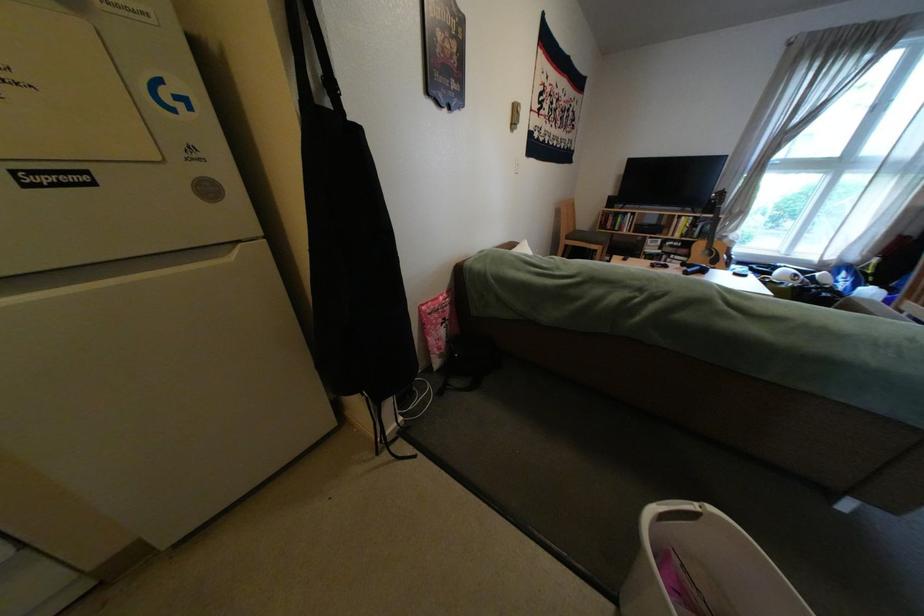
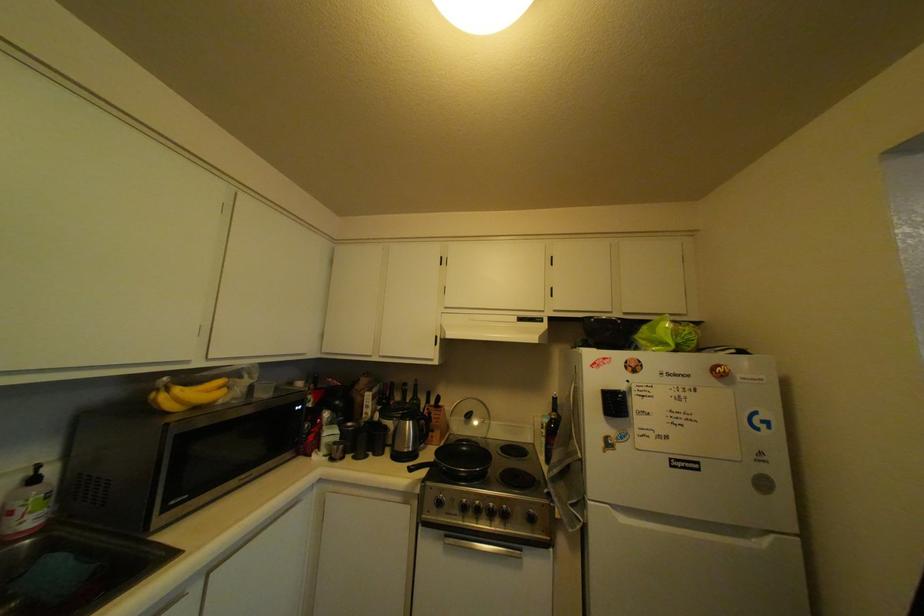
First-person continuous shooting, in which direction is the camera rotating?

The rotation direction of the camera is left-up.